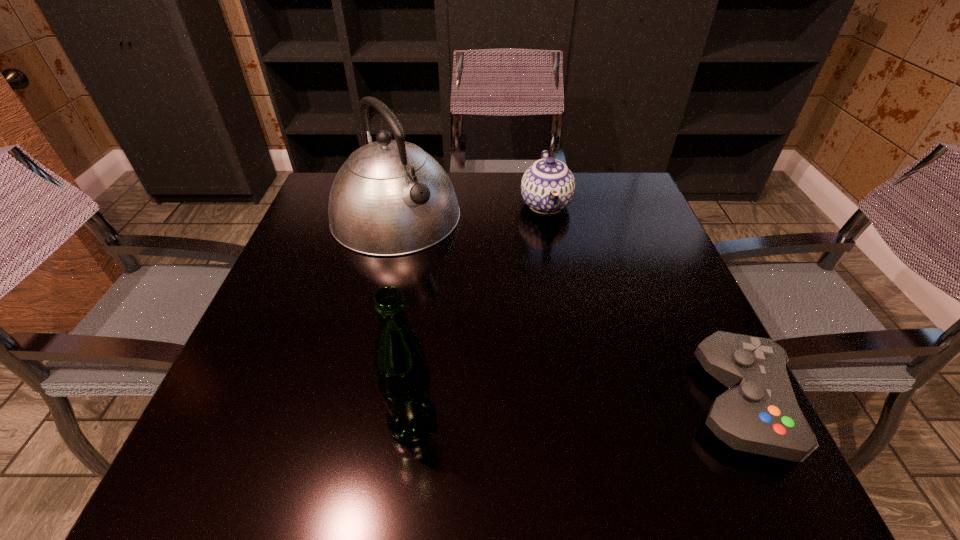
Find the location of a particular element. free space on the desktop that is between the beer bottle and the control and is positioned at the spout of the third object from left to right is located at coordinates (589, 411).

Locate an element on the screen. This screenshot has height=540, width=960. free space on the desktop that is between the beer bottle and the control and is positioned from the spout of the kettle is located at coordinates (572, 413).